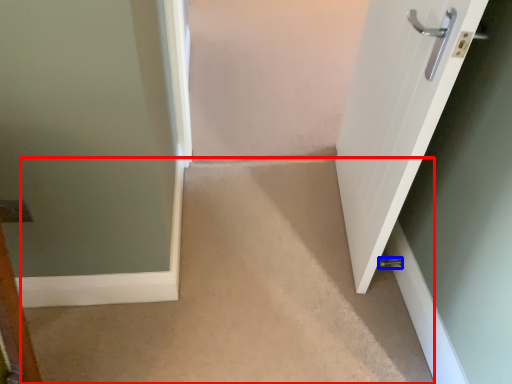
Question: Which object is closer to the camera taking this photo, corridor (highlighted by a red box) or door handle (highlighted by a blue box)?

Choices:
 (A) corridor
 (B) door handle

Answer: (A)